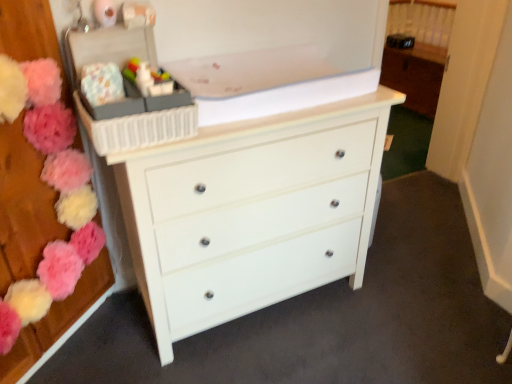
What do you see at coordinates (102, 83) in the screenshot? This screenshot has height=384, width=512. I see `pastel floral fabric at upper left, the first flower when ordered from right to left` at bounding box center [102, 83].

The width and height of the screenshot is (512, 384). What do you see at coordinates (127, 93) in the screenshot?
I see `plastic storage box at upper left` at bounding box center [127, 93].

Locate an element on the screen. plastic storage box at upper left is located at coordinates (127, 93).

Describe the element at coordinates (54, 187) in the screenshot. I see `fluffy fabric flowers at left, marked as the 2th flower in a right-to-left arrangement` at that location.

What do you see at coordinates (148, 78) in the screenshot?
I see `matte plastic toy at upper center` at bounding box center [148, 78].

Image resolution: width=512 pixels, height=384 pixels. What are the coordinates of `white glossy cabinet at upper right` in the screenshot? It's located at (415, 75).

What do you see at coordinates (251, 212) in the screenshot? This screenshot has width=512, height=384. I see `white glossy chest of drawers at center` at bounding box center [251, 212].

What are the coordinates of `pastel floral fabric at upper left, the first flower when ordered from right to left` in the screenshot? It's located at (102, 83).

Is pastel floral fabric at upper left, the first flower when ordered from right to left, turned away from fluffy fabric flowers at left, which appears as the first flower when viewed from the left?

No, pastel floral fabric at upper left, the first flower when ordered from right to left, is not facing away from fluffy fabric flowers at left, which appears as the first flower when viewed from the left.

Is pastel floral fabric at upper left, the first flower when ordered from right to left, spatially inside fluffy fabric flowers at left, marked as the 2th flower in a right-to-left arrangement, or outside of it?

pastel floral fabric at upper left, the first flower when ordered from right to left, is located beyond the bounds of fluffy fabric flowers at left, marked as the 2th flower in a right-to-left arrangement.

From a real-world perspective, between pastel floral fabric at upper left, arranged as the second flower when viewed from the left, and fluffy fabric flowers at left, which appears as the first flower when viewed from the left, who is vertically lower?

fluffy fabric flowers at left, which appears as the first flower when viewed from the left, is physically lower.

Can you see plastic storage box at upper left touching matte plastic toy at upper center?

Indeed, plastic storage box at upper left and matte plastic toy at upper center are beside each other and touching.

Consider the image. From the image's perspective, who appears lower, plastic storage box at upper left or matte plastic toy at upper center?

From the image's view, matte plastic toy at upper center is below.

Which of these two, plastic storage box at upper left or matte plastic toy at upper center, is thinner?

matte plastic toy at upper center.

Does plastic storage box at upper left appear on the left side of matte plastic toy at upper center?

Yes.

You are a GUI agent. You are given a task and a screenshot of the screen. Output one action in this format:
    pyautogui.click(x=<x>, y=<y>)
    Task: Click on the toy in front of the white glossy cabinet at upper right
    This screenshot has height=384, width=512.
    Given the screenshot: What is the action you would take?
    pyautogui.click(x=148, y=78)

From the image's perspective, would you say white glossy cabinet at upper right is positioned over matte plastic toy at upper center?

Yes, from the image's perspective, white glossy cabinet at upper right is on top of matte plastic toy at upper center.

Consider the image. Is white glossy cabinet at upper right not close to matte plastic toy at upper center?

Absolutely, white glossy cabinet at upper right is distant from matte plastic toy at upper center.

Consider the image. Which object is more forward, white glossy cabinet at upper right or matte plastic toy at upper center?

matte plastic toy at upper center is closer to the camera.

Does matte plastic toy at upper center have a larger size compared to plastic storage box at upper left?

No, matte plastic toy at upper center is not bigger than plastic storage box at upper left.

The height and width of the screenshot is (384, 512). Identify the location of toy above the plastic storage box at upper left (from a real-world perspective). (148, 78).

Would you say matte plastic toy at upper center is outside plastic storage box at upper left?

matte plastic toy at upper center lies outside plastic storage box at upper left's area.

Is point (159, 79) closer or farther from the camera than point (160, 141)?

Point (159, 79) is positioned farther from the camera compared to point (160, 141).

Does matte plastic toy at upper center have a lesser width compared to white glossy cabinet at upper right?

Yes, matte plastic toy at upper center is thinner than white glossy cabinet at upper right.

Is white glossy cabinet at upper right a part of matte plastic toy at upper center?

No, white glossy cabinet at upper right is not a part of matte plastic toy at upper center.

Locate an element on the screen. This screenshot has height=384, width=512. toy that is below the white glossy cabinet at upper right (from the image's perspective) is located at coordinates (148, 78).

Does point (154, 311) come farther from viewer compared to point (435, 60)?

No, (154, 311) is in front of (435, 60).

Would you say white glossy chest of drawers at center is outside white glossy cabinet at upper right?

Yes, white glossy chest of drawers at center is not within white glossy cabinet at upper right.

From the image's perspective, is white glossy chest of drawers at center located above white glossy cabinet at upper right?

No, from the image's perspective, white glossy chest of drawers at center is not on top of white glossy cabinet at upper right.

From a real-world perspective, is white glossy chest of drawers at center physically located above or below white glossy cabinet at upper right?

In terms of real-world spatial position, white glossy chest of drawers at center is above white glossy cabinet at upper right.

Is white glossy cabinet at upper right not within pastel floral fabric at upper left, arranged as the second flower when viewed from the left?

white glossy cabinet at upper right lies outside pastel floral fabric at upper left, arranged as the second flower when viewed from the left,'s area.

Is white glossy cabinet at upper right facing away from pastel floral fabric at upper left, arranged as the second flower when viewed from the left?

No.

Between white glossy cabinet at upper right and pastel floral fabric at upper left, the first flower when ordered from right to left, which one has more height?

With more height is white glossy cabinet at upper right.

Find the location of a particular element. Image resolution: width=512 pixels, height=384 pixels. cabinetry behind the pastel floral fabric at upper left, the first flower when ordered from right to left is located at coordinates (415, 75).

The width and height of the screenshot is (512, 384). Identify the location of flower behind the fluffy fabric flowers at left, which appears as the first flower when viewed from the left. (102, 83).

The width and height of the screenshot is (512, 384). I want to click on storage box located underneath the matte plastic toy at upper center (from a real-world perspective), so click(x=127, y=93).

Which object lies further to the anchor point matte plastic toy at upper center, white glossy chest of drawers at center or plastic storage box at upper left?

white glossy chest of drawers at center is further to matte plastic toy at upper center.

When comparing their distances from matte plastic toy at upper center, does fluffy fabric flowers at left, which appears as the first flower when viewed from the left, or white glossy chest of drawers at center seem closer?

fluffy fabric flowers at left, which appears as the first flower when viewed from the left, is closer to matte plastic toy at upper center.

From the image, which object appears to be farther from matte plastic toy at upper center, pastel floral fabric at upper left, the first flower when ordered from right to left, or white glossy cabinet at upper right?

white glossy cabinet at upper right is further to matte plastic toy at upper center.

Looking at the image, which one is located further to white glossy cabinet at upper right, pastel floral fabric at upper left, arranged as the second flower when viewed from the left, or fluffy fabric flowers at left, marked as the 2th flower in a right-to-left arrangement?

fluffy fabric flowers at left, marked as the 2th flower in a right-to-left arrangement.

Consider the image. When comparing their distances from pastel floral fabric at upper left, the first flower when ordered from right to left, does matte plastic toy at upper center or plastic storage box at upper left seem closer?

Among the two, matte plastic toy at upper center is located nearer to pastel floral fabric at upper left, the first flower when ordered from right to left.

Considering their positions, is plastic storage box at upper left positioned closer to fluffy fabric flowers at left, which appears as the first flower when viewed from the left, than matte plastic toy at upper center?

plastic storage box at upper left lies closer to fluffy fabric flowers at left, which appears as the first flower when viewed from the left, than the other object.

Estimate the real-world distances between objects in this image. Which object is closer to white glossy chest of drawers at center, pastel floral fabric at upper left, the first flower when ordered from right to left, or fluffy fabric flowers at left, marked as the 2th flower in a right-to-left arrangement?

The object closer to white glossy chest of drawers at center is fluffy fabric flowers at left, marked as the 2th flower in a right-to-left arrangement.

When comparing their distances from white glossy cabinet at upper right, does fluffy fabric flowers at left, which appears as the first flower when viewed from the left, or pastel floral fabric at upper left, the first flower when ordered from right to left, seem closer?

pastel floral fabric at upper left, the first flower when ordered from right to left, lies closer to white glossy cabinet at upper right than the other object.

This screenshot has width=512, height=384. I want to click on storage box positioned between white glossy chest of drawers at center and white glossy cabinet at upper right from near to far, so click(127, 93).

This screenshot has height=384, width=512. Find the location of `toy positioned between fluffy fabric flowers at left, which appears as the first flower when viewed from the left, and plastic storage box at upper left from near to far`. toy positioned between fluffy fabric flowers at left, which appears as the first flower when viewed from the left, and plastic storage box at upper left from near to far is located at coordinates (148, 78).

Image resolution: width=512 pixels, height=384 pixels. Find the location of `flower between white glossy chest of drawers at center and white glossy cabinet at upper right along the z-axis`. flower between white glossy chest of drawers at center and white glossy cabinet at upper right along the z-axis is located at coordinates (102, 83).

Locate an element on the screen. Image resolution: width=512 pixels, height=384 pixels. storage box located between fluffy fabric flowers at left, which appears as the first flower when viewed from the left, and white glossy cabinet at upper right in the depth direction is located at coordinates (127, 93).